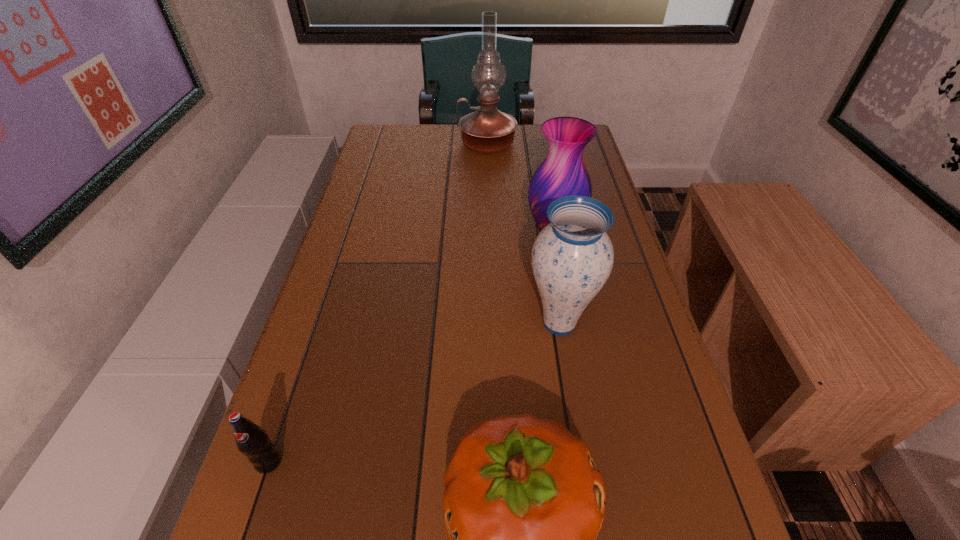
Find the location of `object present at the far edge`. object present at the far edge is located at coordinates (487, 130).

The height and width of the screenshot is (540, 960). Identify the location of object located in the left edge section of the desktop. (252, 441).

The height and width of the screenshot is (540, 960). I want to click on vacant space at the left edge of the desktop, so click(x=340, y=303).

The height and width of the screenshot is (540, 960). I want to click on free space at the right edge of the desktop, so click(x=612, y=312).

Locate an element on the screen. vacant space at the far left corner is located at coordinates (382, 153).

At what (x,y) coordinates should I click in order to perform the action: click on vacant area at the far right corner. Please return your answer as a coordinate pair (x, y). Image resolution: width=960 pixels, height=540 pixels. Looking at the image, I should click on (548, 151).

The image size is (960, 540). In order to click on free space between the farthest object and the leftmost object in this screenshot , I will do click(378, 303).

Locate an element on the screen. This screenshot has width=960, height=540. free area in between the third farthest object and the shortest object is located at coordinates (414, 393).

The width and height of the screenshot is (960, 540). Find the location of `free space between the nearer vase and the pop`. free space between the nearer vase and the pop is located at coordinates (414, 393).

Locate an element on the screen. free spot between the farther vase and the oil lamp is located at coordinates (520, 188).